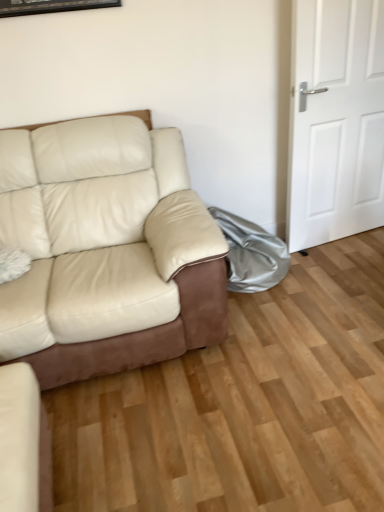
The width and height of the screenshot is (384, 512). In order to click on free space in front of white matte door at right in this screenshot , I will do `click(336, 268)`.